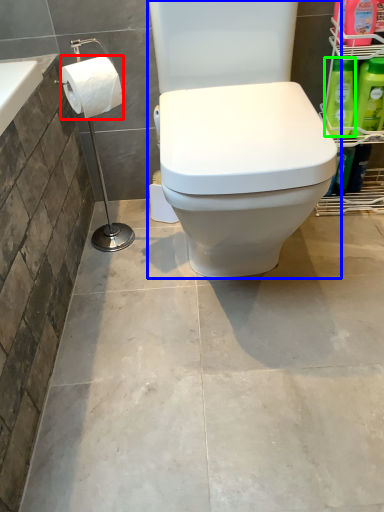
Question: Which object is the closest to the toilet paper (highlighted by a red box)? Choose among these: toilet (highlighted by a blue box) or cleaning product (highlighted by a green box).

Choices:
 (A) toilet
 (B) cleaning product

Answer: (A)